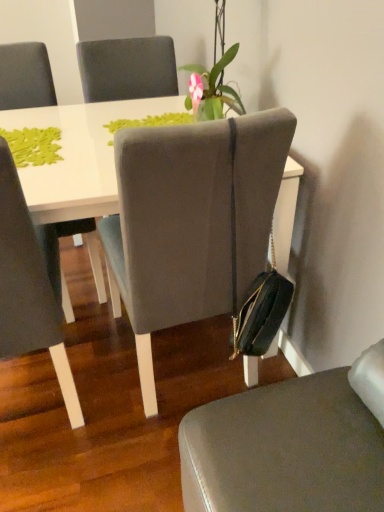
Question: From the image's perspective, does matte gray chair at left, the 1th chair viewed from the left, appear lower than green matte plant at upper center?

Choices:
 (A) yes
 (B) no

Answer: (A)

Question: Is matte gray chair at left, the 1th chair viewed from the left, bigger than green matte plant at upper center?

Choices:
 (A) yes
 (B) no

Answer: (A)

Question: Is matte gray chair at left, the 1th chair viewed from the left, facing away from green matte plant at upper center?

Choices:
 (A) no
 (B) yes

Answer: (A)

Question: Is matte gray chair at left, the 1th chair viewed from the left, to the left of green matte plant at upper center from the viewer's perspective?

Choices:
 (A) no
 (B) yes

Answer: (B)

Question: Can green matte plant at upper center be found inside matte gray chair at left, positioned as the third chair in right-to-left order?

Choices:
 (A) yes
 (B) no

Answer: (B)

Question: Is matte gray chair at left, positioned as the third chair in right-to-left order, not close to green matte plant at upper center?

Choices:
 (A) no
 (B) yes

Answer: (A)

Question: From the image's perspective, is suede-like gray chair at center, which is the second chair in right-to-left order, on green matte plant at upper center?

Choices:
 (A) no
 (B) yes

Answer: (A)

Question: Would you say suede-like gray chair at center, placed as the 2th chair when sorted from left to right, contains green matte plant at upper center?

Choices:
 (A) no
 (B) yes

Answer: (A)

Question: Does suede-like gray chair at center, which is the second chair in right-to-left order, have a smaller size compared to green matte plant at upper center?

Choices:
 (A) yes
 (B) no

Answer: (B)

Question: From the image's perspective, is suede-like gray chair at center, which is the second chair in right-to-left order, beneath green matte plant at upper center?

Choices:
 (A) no
 (B) yes

Answer: (B)

Question: Is suede-like gray chair at center, placed as the 2th chair when sorted from left to right, not inside green matte plant at upper center?

Choices:
 (A) yes
 (B) no

Answer: (A)

Question: Is suede-like gray chair at center, placed as the 2th chair when sorted from left to right, thinner than green matte plant at upper center?

Choices:
 (A) yes
 (B) no

Answer: (B)

Question: Would you say suede-like gray chair at center, which is the second chair in right-to-left order, contains matte gray chair at left, the 1th chair viewed from the left?

Choices:
 (A) yes
 (B) no

Answer: (B)